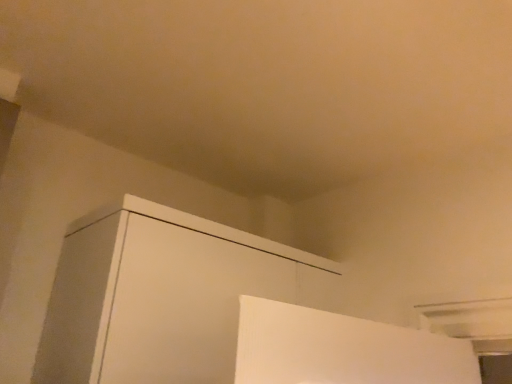
Where is `white matte cabinet at center`? This screenshot has width=512, height=384. white matte cabinet at center is located at coordinates (163, 296).

Describe the element at coordinates (163, 296) in the screenshot. I see `white matte cabinet at center` at that location.

Locate an element on the screen. white matte cabinet at center is located at coordinates (163, 296).